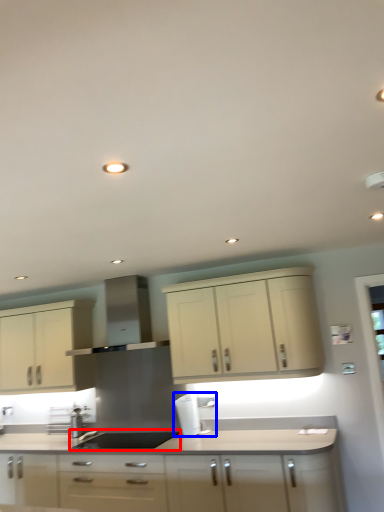
Question: Which object appears farthest to the camera in this image, sink (highlighted by a red box) or coffee machine (highlighted by a blue box)?

Choices:
 (A) sink
 (B) coffee machine

Answer: (B)